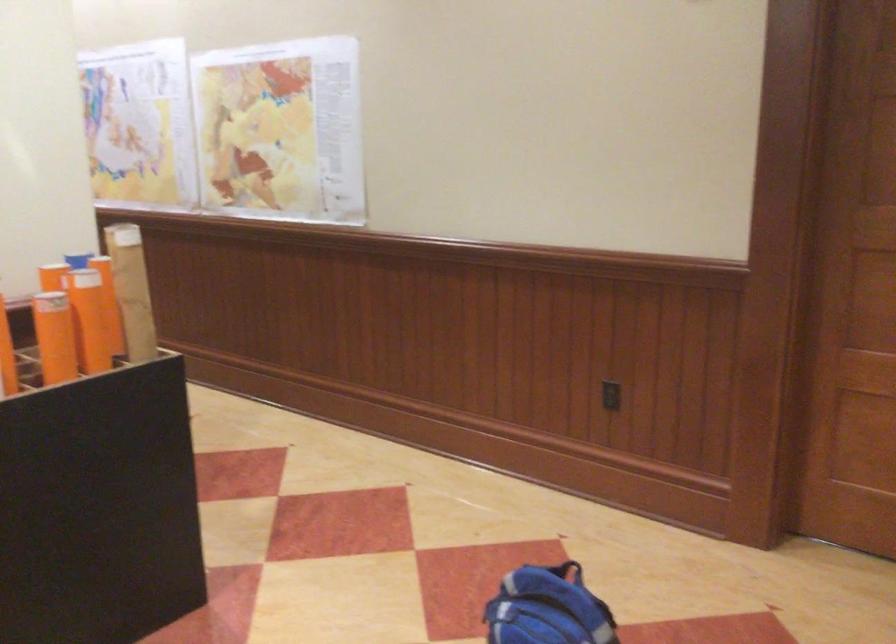
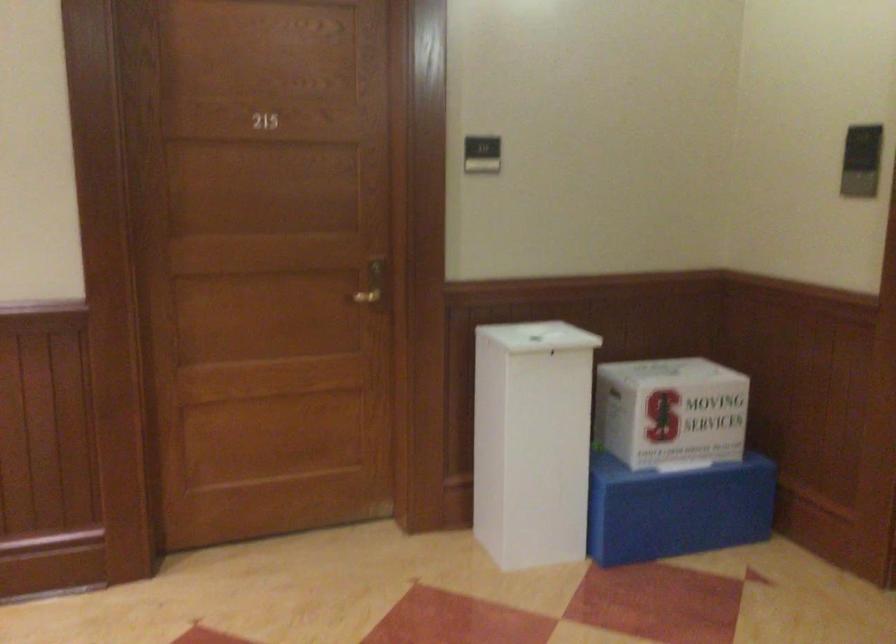
Question: The first image is from the beginning of the video and the second image is from the end. How did the camera likely rotate when shooting the video?

Choices:
 (A) Left
 (B) Right
 (C) Up
 (D) Down

Answer: (B)